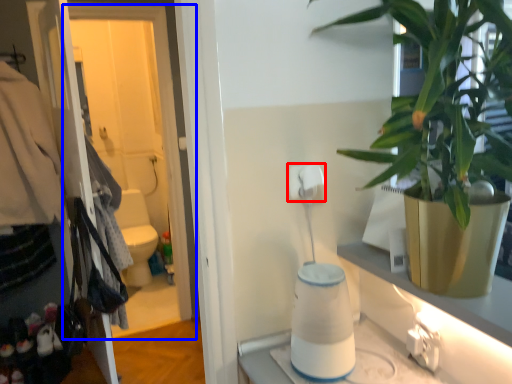
Question: Which of the following is the closest to the observer, toilet paper (highlighted by a red box) or screen door (highlighted by a blue box)?

Choices:
 (A) toilet paper
 (B) screen door

Answer: (A)